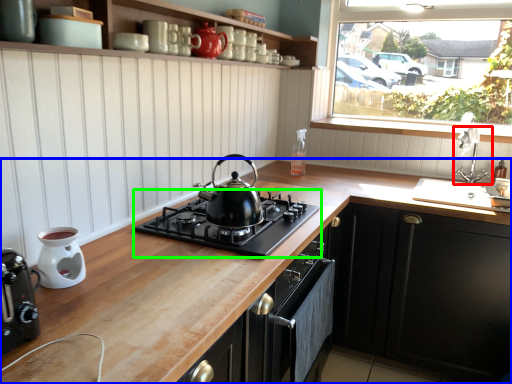
Question: Estimate the real-world distances between objects in this image. Which object is closer to tap (highlighted by a red box), countertop (highlighted by a blue box) or gas stove (highlighted by a green box)?

Choices:
 (A) countertop
 (B) gas stove

Answer: (A)